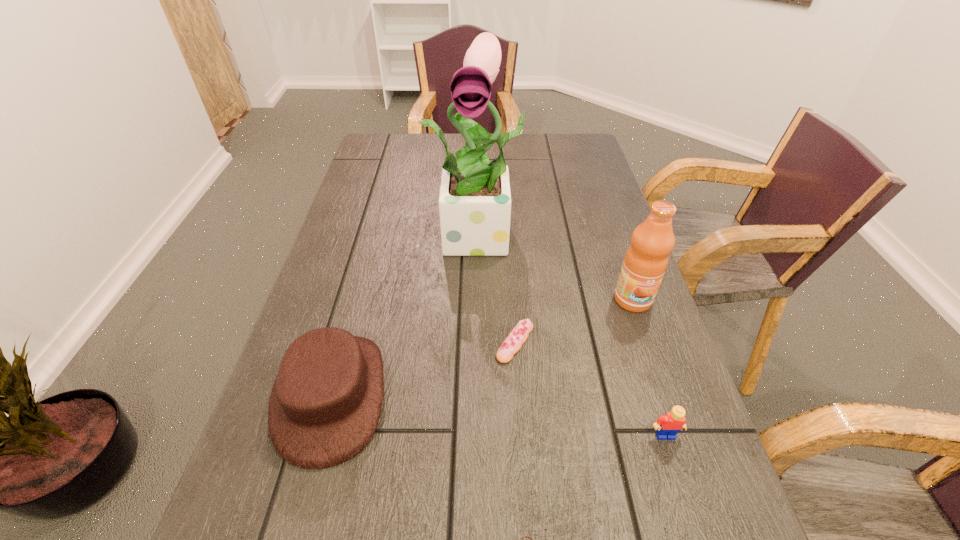
This screenshot has height=540, width=960. What are the coordinates of `vacant point located 0.100m on the face of the fourth tallest object` in the screenshot? It's located at (686, 503).

You are a GUI agent. You are given a task and a screenshot of the screen. Output one action in this format:
    pyautogui.click(x=<x>, y=<y>)
    Task: Click on the vacant region located on the right of the second shortest object
    
    Given the screenshot: What is the action you would take?
    pyautogui.click(x=564, y=342)

The image size is (960, 540). Find the location of `object that is at the left edge`. object that is at the left edge is located at coordinates (325, 404).

Locate an element on the screen. fruit juice located in the right edge section of the desktop is located at coordinates (645, 262).

You are a GUI agent. You are given a task and a screenshot of the screen. Output one action in this format:
    pyautogui.click(x=<x>, y=<y>)
    Task: Click on the Lego that is at the right edge
    Image resolution: width=960 pixels, height=540 pixels.
    Given the screenshot: What is the action you would take?
    pyautogui.click(x=667, y=426)

Where is `vacant region at the far edge of the desktop`? The width and height of the screenshot is (960, 540). vacant region at the far edge of the desktop is located at coordinates (418, 153).

Locate an element on the screen. free space at the left edge of the desktop is located at coordinates (331, 326).

In order to click on vacant space at the right edge of the desktop in this screenshot , I will do `click(560, 183)`.

The height and width of the screenshot is (540, 960). In order to click on vacant space at the far left corner in this screenshot , I will do `click(405, 137)`.

The width and height of the screenshot is (960, 540). I want to click on vacant space at the far right corner of the desktop, so click(566, 140).